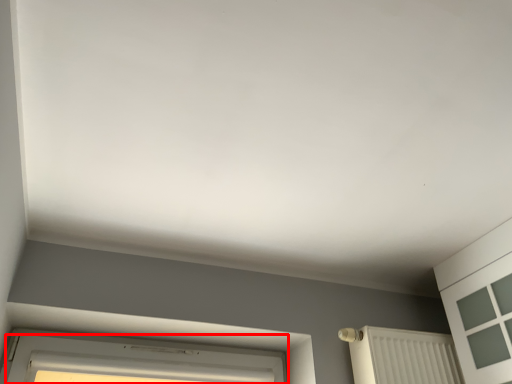
Question: From the image's perspective, considering the relative positions of window (annotated by the red box) and radiator in the image provided, where is window (annotated by the red box) located with respect to the staircase?

Choices:
 (A) above
 (B) below

Answer: (B)